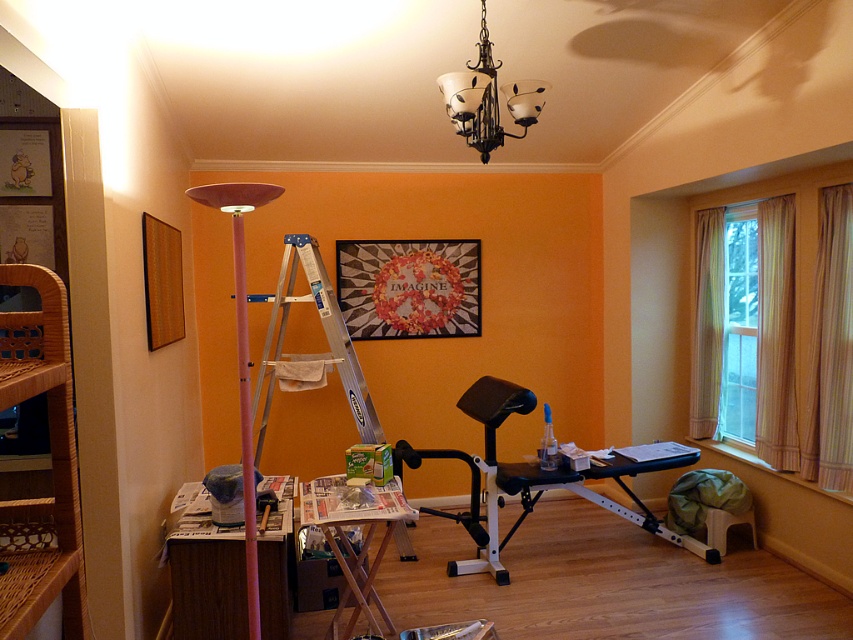
Which is more to the left, silver/aluminum ladder at center or wooden picture frame at left?

Positioned to the left is wooden picture frame at left.

Does point (370, 401) come in front of point (165, 260)?

No, (370, 401) is behind (165, 260).

The image size is (853, 640). I want to click on silver/aluminum ladder at center, so click(325, 336).

Locate an element on the screen. The image size is (853, 640). silver/aluminum ladder at center is located at coordinates (325, 336).

How much distance is there between woven wood bookshelf at left and wooden folding table at center?

1.45 meters

Who is shorter, woven wood bookshelf at left or wooden folding table at center?

Standing shorter between the two is wooden folding table at center.

Does point (61, 387) come behind point (412, 556)?

No, (61, 387) is closer to viewer.

Where is `woven wood bookshelf at left`? The image size is (853, 640). woven wood bookshelf at left is located at coordinates (50, 456).

Who is positioned more to the right, silver/aluminum ladder at center or clear glass window at center?

clear glass window at center

This screenshot has width=853, height=640. Identify the location of silver/aluminum ladder at center. (325, 336).